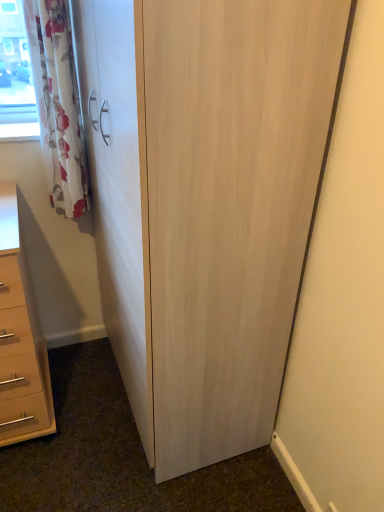
Question: From a real-world perspective, is light wood cupboard at center positioned over matte beige chest of drawers at lower left based on gravity?

Choices:
 (A) yes
 (B) no

Answer: (A)

Question: Is the surface of light wood cupboard at center in direct contact with matte beige chest of drawers at lower left?

Choices:
 (A) no
 (B) yes

Answer: (A)

Question: Is light wood cupboard at center positioned in front of matte beige chest of drawers at lower left?

Choices:
 (A) no
 (B) yes

Answer: (B)

Question: Is light wood cupboard at center thinner than matte beige chest of drawers at lower left?

Choices:
 (A) no
 (B) yes

Answer: (B)

Question: From the image's perspective, does light wood cupboard at center appear higher than matte beige chest of drawers at lower left?

Choices:
 (A) no
 (B) yes

Answer: (B)

Question: Would you say light wood cupboard at center is to the left or to the right of white floral fabric curtain at upper left in the picture?

Choices:
 (A) left
 (B) right

Answer: (B)

Question: In terms of size, does light wood cupboard at center appear bigger or smaller than white floral fabric curtain at upper left?

Choices:
 (A) small
 (B) big

Answer: (B)

Question: Is light wood cupboard at center wider or thinner than white floral fabric curtain at upper left?

Choices:
 (A) wide
 (B) thin

Answer: (A)

Question: In terms of height, does light wood cupboard at center look taller or shorter compared to white floral fabric curtain at upper left?

Choices:
 (A) tall
 (B) short

Answer: (A)

Question: From a real-world perspective, is white floral fabric curtain at upper left physically located above or below matte beige chest of drawers at lower left?

Choices:
 (A) above
 (B) below

Answer: (A)

Question: From the image's perspective, relative to matte beige chest of drawers at lower left, is white floral fabric curtain at upper left above or below?

Choices:
 (A) above
 (B) below

Answer: (A)

Question: Looking at their shapes, would you say white floral fabric curtain at upper left is wider or thinner than matte beige chest of drawers at lower left?

Choices:
 (A) wide
 (B) thin

Answer: (B)

Question: Do you think white floral fabric curtain at upper left is within matte beige chest of drawers at lower left, or outside of it?

Choices:
 (A) outside
 (B) inside

Answer: (A)

Question: From the image's perspective, is light wood cupboard at center located above or below matte beige chest of drawers at lower left?

Choices:
 (A) below
 (B) above

Answer: (B)

Question: Which is correct: light wood cupboard at center is inside matte beige chest of drawers at lower left, or outside of it?

Choices:
 (A) outside
 (B) inside

Answer: (A)